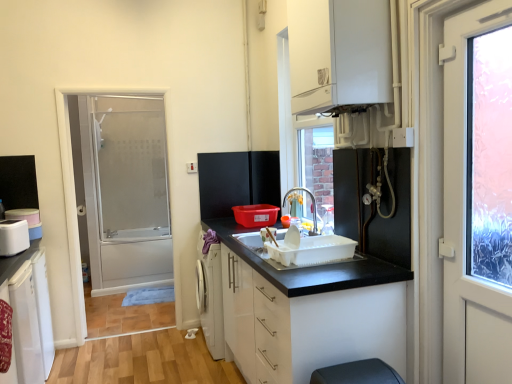
Question: Considering the relative positions of white matte refrigerator at lower left, arranged as the third cabinetry when viewed from the right, and white matte door at right in the image provided, is white matte refrigerator at lower left, arranged as the third cabinetry when viewed from the right, to the left or to the right of white matte door at right?

Choices:
 (A) left
 (B) right

Answer: (A)

Question: From a real-world perspective, relative to white matte door at right, is white matte refrigerator at lower left, which is counted as the 1th cabinetry, starting from the bottom, vertically above or below?

Choices:
 (A) below
 (B) above

Answer: (A)

Question: Estimate the real-world distances between objects in this image. Which object is farther from the white matte refrigerator at lower left, arranged as the third cabinetry when viewed from the right?

Choices:
 (A) black matte refrigerator at center, arranged as the second appliance when viewed from the left
 (B) white glossy cabinet at upper center, which is the third cabinetry from left to right
 (C) white matte door at right
 (D) white matte cabinet at center, which is the 2th cabinetry from left to right
 (E) white plastic container at left, acting as the first appliance starting from the bottom

Answer: (C)

Question: Based on their relative distances, which object is nearer to the matte silver faucet at upper center?

Choices:
 (A) frosted glass shower door at left
 (B) white matte refrigerator at lower left, which is counted as the 1th cabinetry, starting from the bottom
 (C) white glossy cabinet at upper center, which is the third cabinetry from left to right
 (D) white matte cabinet at center, positioned as the second cabinetry in right-to-left order
 (E) black matte refrigerator at center, which is the 1th appliance in top-to-bottom order

Answer: (E)